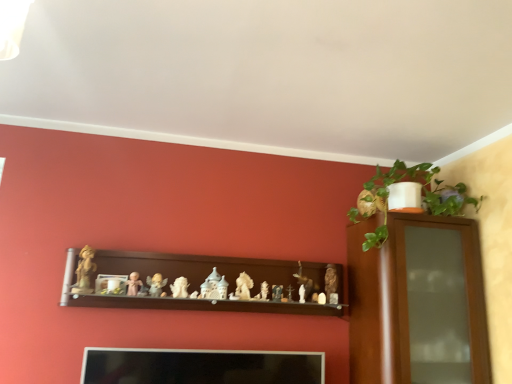
Question: Which direction should I rotate to look at matte beige figurine at center, which is the 10th toy from right to left, — up or down?

Choices:
 (A) up
 (B) down

Answer: (B)

Question: Is matte white figurine at center, which ranks as the seventh toy in left-to-right order, located outside matte gold figurine at center, marked as the 10th toy in a left-to-right arrangement?

Choices:
 (A) yes
 (B) no

Answer: (A)

Question: Is matte white figurine at center, which is the fifth toy in right-to-left order, in front of matte gold figurine at center, which is counted as the second toy, starting from the right?

Choices:
 (A) yes
 (B) no

Answer: (A)

Question: Does matte white figurine at center, which is the fifth toy in right-to-left order, come behind matte gold figurine at center, marked as the 10th toy in a left-to-right arrangement?

Choices:
 (A) no
 (B) yes

Answer: (A)

Question: Is matte white figurine at center, which ranks as the seventh toy in left-to-right order, bigger than matte gold figurine at center, which is counted as the second toy, starting from the right?

Choices:
 (A) yes
 (B) no

Answer: (B)

Question: Considering the relative sizes of matte white figurine at center, which ranks as the seventh toy in left-to-right order, and matte gold figurine at center, marked as the 10th toy in a left-to-right arrangement, in the image provided, is matte white figurine at center, which ranks as the seventh toy in left-to-right order, thinner than matte gold figurine at center, marked as the 10th toy in a left-to-right arrangement,?

Choices:
 (A) yes
 (B) no

Answer: (B)

Question: From a real-world perspective, is matte white figurine at center, which is the fifth toy in right-to-left order, physically above matte gold figurine at center, which is counted as the second toy, starting from the right?

Choices:
 (A) no
 (B) yes

Answer: (A)

Question: From a real-world perspective, is white porcelain castle at center, which appears as the 7th toy when viewed from the right, on matte white figurine at center, which ranks as the seventh toy in left-to-right order?

Choices:
 (A) no
 (B) yes

Answer: (B)

Question: Is white porcelain castle at center, which appears as the 5th toy when viewed from the left, aimed at matte white figurine at center, which is the fifth toy in right-to-left order?

Choices:
 (A) yes
 (B) no

Answer: (B)

Question: Is white porcelain castle at center, which appears as the 7th toy when viewed from the right, bigger than matte white figurine at center, which is the fifth toy in right-to-left order?

Choices:
 (A) yes
 (B) no

Answer: (A)

Question: Is white porcelain castle at center, which appears as the 7th toy when viewed from the right, wider than matte white figurine at center, which is the fifth toy in right-to-left order?

Choices:
 (A) no
 (B) yes

Answer: (B)

Question: Is white porcelain castle at center, which appears as the 7th toy when viewed from the right, placed right next to matte white figurine at center, which is the fifth toy in right-to-left order?

Choices:
 (A) yes
 (B) no

Answer: (B)

Question: Can we say white porcelain castle at center, which appears as the 5th toy when viewed from the left, lies outside matte white figurine at center, which ranks as the seventh toy in left-to-right order?

Choices:
 (A) yes
 (B) no

Answer: (A)

Question: Is white glossy statue at center, positioned as the fourth toy in left-to-right order, outside smooth wooden cross at center, which ranks as the 3th toy in right-to-left order?

Choices:
 (A) yes
 (B) no

Answer: (A)